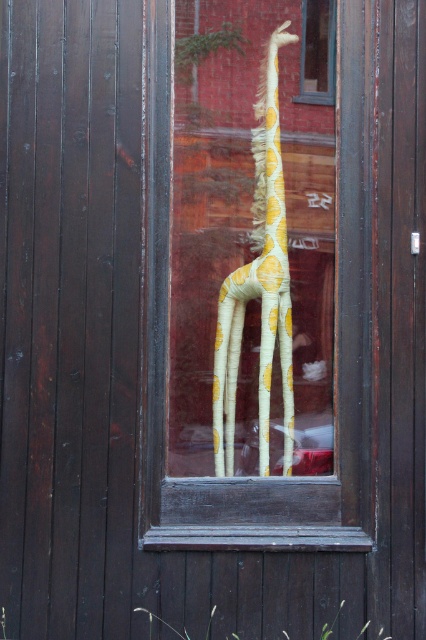
You are trying to hang a small picture frame on the wall next to the wooden door. The picture frame is exactly the same height as the transparent glass window at upper center. Will the wooden frame at center on the door be taller than your picture frame?

The wooden frame at center is taller than transparent glass window at upper center, so yes, the wooden frame at center will be taller than your picture frame since it exceeds the height of the transparent glass window at upper center.

You are standing in front of the wooden door with a window. There is a point marked at coordinates (259, 284). What object is located at that point?

The point at coordinates (259, 284) marks the yellow paper giraffe at center.